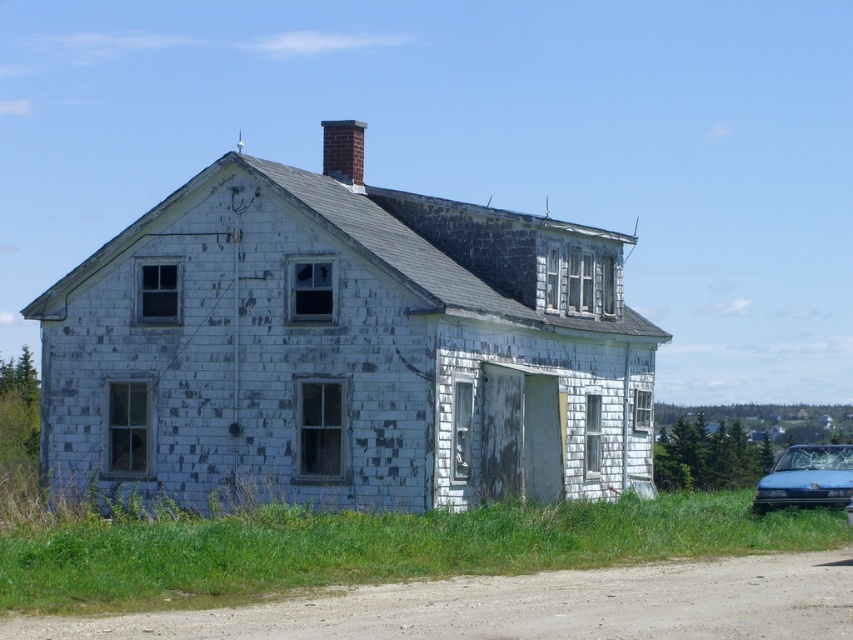
Which of these two, dusty gravel road at lower center or blue matte car at lower right, stands shorter?

dusty gravel road at lower center

At what (x,y) coordinates should I click in order to perform the action: click on dusty gravel road at lower center. Please return your answer as a coordinate pair (x, y). The image size is (853, 640). Looking at the image, I should click on (525, 605).

This screenshot has width=853, height=640. What are the coordinates of `dusty gravel road at lower center` in the screenshot? It's located at (525, 605).